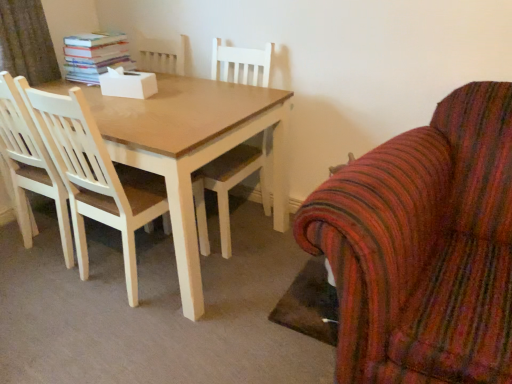
Question: Considering the relative sizes of light wood chair at left, positioned as the 1th chair in left-to-right order, and striped fabric armchair at right, the second chair when ordered from left to right, in the image provided, is light wood chair at left, positioned as the 1th chair in left-to-right order, smaller than striped fabric armchair at right, the second chair when ordered from left to right,?

Choices:
 (A) yes
 (B) no

Answer: (A)

Question: Considering the relative positions of light wood chair at left, which is the 2th chair from right to left, and striped fabric armchair at right, the second chair when ordered from left to right, in the image provided, is light wood chair at left, which is the 2th chair from right to left, to the right of striped fabric armchair at right, the second chair when ordered from left to right, from the viewer's perspective?

Choices:
 (A) yes
 (B) no

Answer: (B)

Question: Is light wood chair at left, positioned as the 1th chair in left-to-right order, surrounding striped fabric armchair at right, the second chair when ordered from left to right?

Choices:
 (A) yes
 (B) no

Answer: (B)

Question: From a real-world perspective, is light wood chair at left, positioned as the 1th chair in left-to-right order, below striped fabric armchair at right, marked as the 1th chair in a right-to-left arrangement?

Choices:
 (A) yes
 (B) no

Answer: (B)

Question: From the image's perspective, is light wood chair at left, positioned as the 1th chair in left-to-right order, located beneath striped fabric armchair at right, the second chair when ordered from left to right?

Choices:
 (A) yes
 (B) no

Answer: (B)

Question: In terms of height, does hardcover books at upper left look taller or shorter compared to striped fabric armchair at right, the second chair when ordered from left to right?

Choices:
 (A) tall
 (B) short

Answer: (B)

Question: Would you say hardcover books at upper left is inside or outside striped fabric armchair at right, marked as the 1th chair in a right-to-left arrangement?

Choices:
 (A) outside
 (B) inside

Answer: (A)

Question: Looking at the image, does hardcover books at upper left seem bigger or smaller compared to striped fabric armchair at right, marked as the 1th chair in a right-to-left arrangement?

Choices:
 (A) big
 (B) small

Answer: (B)

Question: Relative to striped fabric armchair at right, the second chair when ordered from left to right, is hardcover books at upper left in front or behind?

Choices:
 (A) front
 (B) behind

Answer: (B)

Question: Does point (379, 329) appear closer or farther from the camera than point (125, 59)?

Choices:
 (A) closer
 (B) farther

Answer: (A)

Question: Would you say striped fabric armchair at right, marked as the 1th chair in a right-to-left arrangement, is inside or outside hardcover books at upper left?

Choices:
 (A) outside
 (B) inside

Answer: (A)

Question: From the image's perspective, is striped fabric armchair at right, the second chair when ordered from left to right, positioned above or below hardcover books at upper left?

Choices:
 (A) above
 (B) below

Answer: (B)

Question: Is striped fabric armchair at right, the second chair when ordered from left to right, taller or shorter than hardcover books at upper left?

Choices:
 (A) tall
 (B) short

Answer: (A)

Question: In the image, is light wood chair at left, positioned as the 1th chair in left-to-right order, on the left side or the right side of striped fabric armchair at right, the second chair when ordered from left to right?

Choices:
 (A) left
 (B) right

Answer: (A)

Question: Is light wood chair at left, which is the 2th chair from right to left, spatially inside striped fabric armchair at right, the second chair when ordered from left to right, or outside of it?

Choices:
 (A) inside
 (B) outside

Answer: (B)